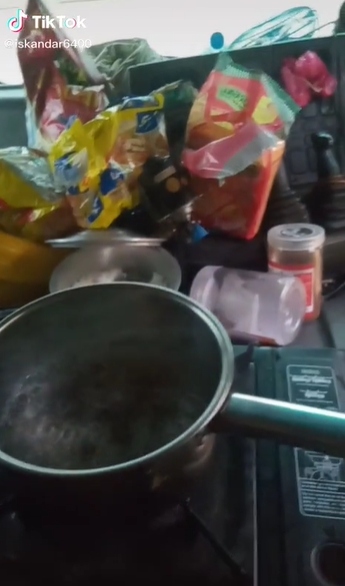
What are the coordinates of `frying pan handle` in the screenshot? It's located at (268, 430).